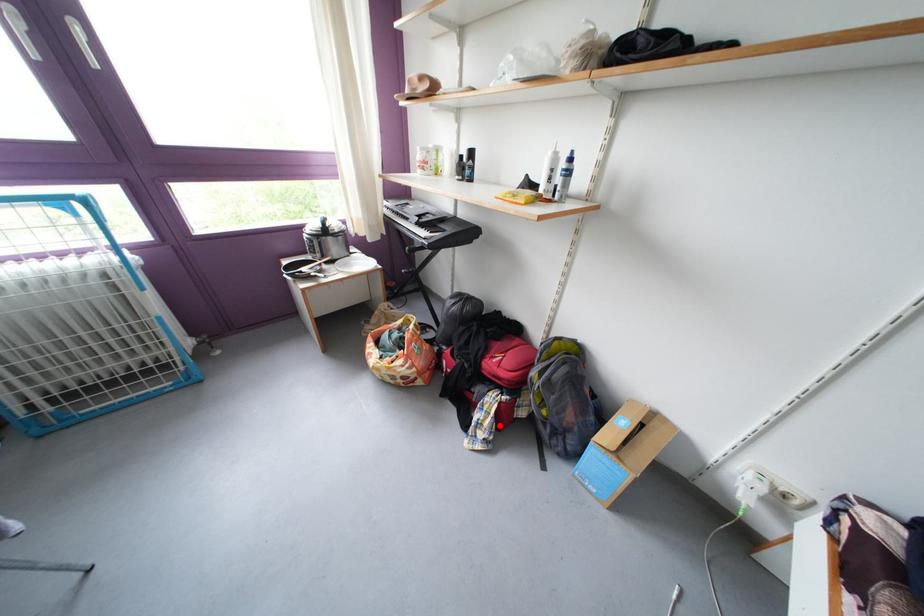
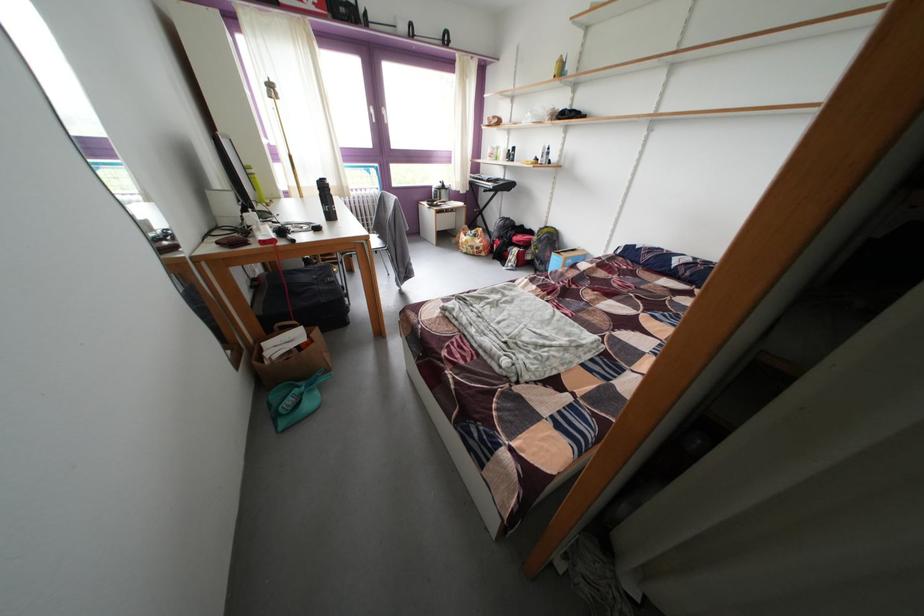
Question: I am providing you with two images of the same scene from different viewpoints. A red point is marked on the first image. Can you still see the location of the red point in image 2?

Choices:
 (A) Yes
 (B) No

Answer: (B)